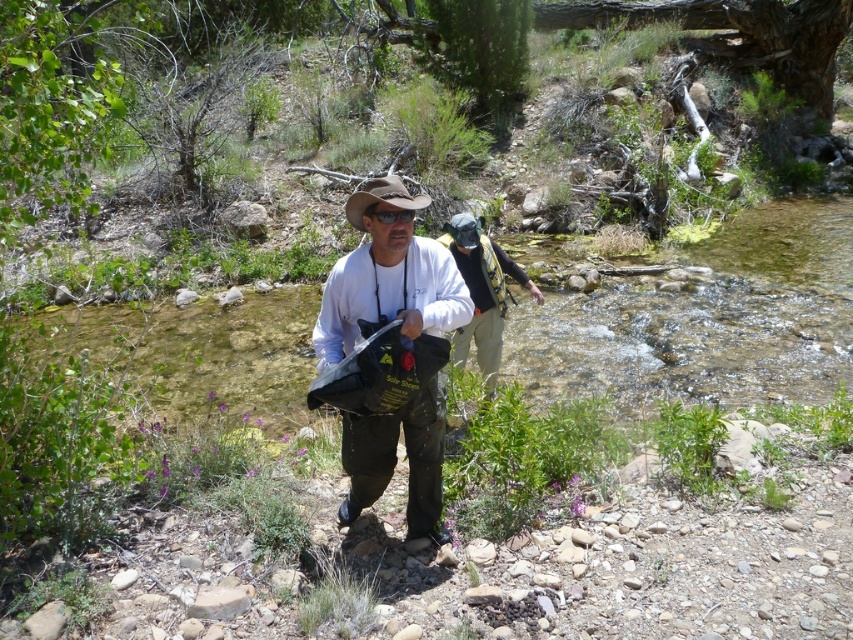
You are a hiker planning to cross a river. You see two points marked on the riverbank. The first point is at coordinates point (489, 380) and the second point is at point (393, 186). Which point should you choose to cross the river if you want to reach the destination behind the second point?

You should choose point (393, 186) because point (489, 380) is behind point (393, 186), so crossing at the second point will allow you to reach the destination behind the second point more directly.

You are trying to locate the matte black bag at center and the matte black backpack at center in the image. From the perspective of someone facing the scene, which object is positioned to the left?

The matte black bag at center is positioned to the left of the matte black backpack at center.

You are planning to carry both the matte black bag at center and the matte black backpack at center while hiking. Given their sizes, which one can you place in the other without exceeding the space?

The matte black bag at center has a lesser width compared to the matte black backpack at center. Therefore, the matte black bag at center can be placed inside the matte black backpack at center, but not vice versa.